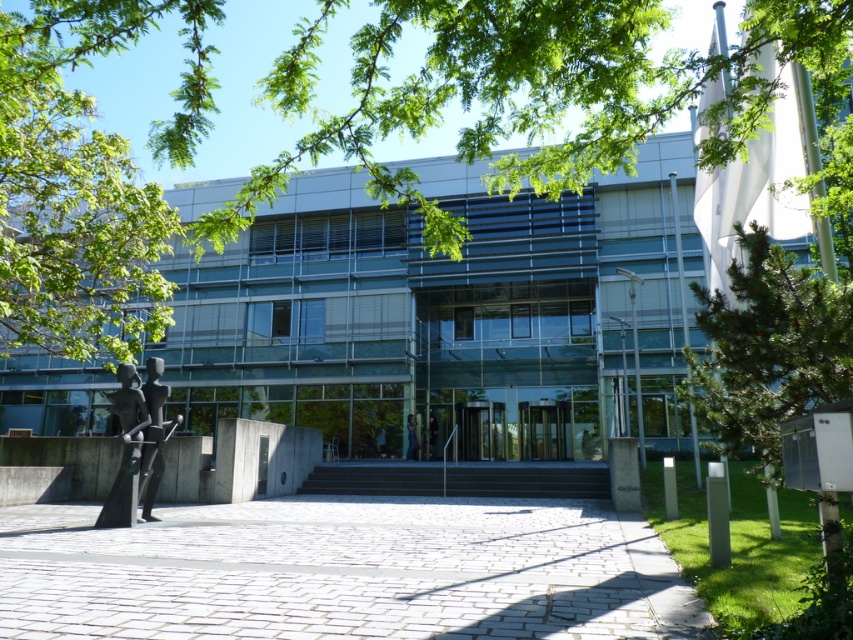
Is green pine tree at right smaller than transparent glass door at center?

Yes, green pine tree at right is smaller than transparent glass door at center.

Can you confirm if green pine tree at right is thinner than transparent glass door at center?

Indeed, green pine tree at right has a lesser width compared to transparent glass door at center.

You are a GUI agent. You are given a task and a screenshot of the screen. Output one action in this format:
    pyautogui.click(x=<x>, y=<y>)
    Task: Click on the green pine tree at right
    Image resolution: width=853 pixels, height=640 pixels.
    Given the screenshot: What is the action you would take?
    pyautogui.click(x=769, y=348)

This screenshot has height=640, width=853. What are the coordinates of `green pine tree at right` in the screenshot? It's located at (769, 348).

Is green leafy tree at left closer to camera compared to green pine tree at right?

Yes, green leafy tree at left is closer to the viewer.

Which is more to the right, green leafy tree at left or green pine tree at right?

Positioned to the right is green pine tree at right.

Where is `green leafy tree at left`? green leafy tree at left is located at coordinates (86, 180).

Does green leafy tree at left have a greater height compared to polished bronze statue at lower left?

Correct, green leafy tree at left is much taller as polished bronze statue at lower left.

Is point (57, 253) farther from camera compared to point (146, 451)?

Yes, it is behind point (146, 451).

Which is in front, point (68, 109) or point (163, 467)?

Point (163, 467) is in front.

Locate an element on the screen. The image size is (853, 640). green leafy tree at left is located at coordinates (86, 180).